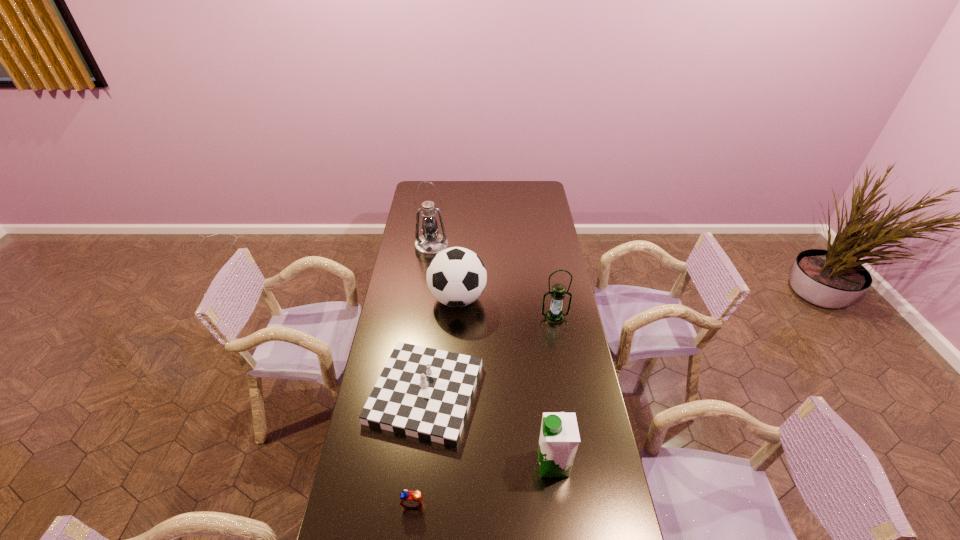
Identify the location of free space located 0.390m on the side where the lantern emits light. (570, 406).

Image resolution: width=960 pixels, height=540 pixels. I want to click on vacant space located on the right of the soccer ball, so click(529, 299).

Locate an element on the screen. blank area located 0.160m on the front-facing side of the second nearest object is located at coordinates (486, 464).

Locate an element on the screen. free region located 0.240m on the front-facing side of the second nearest object is located at coordinates (461, 464).

The width and height of the screenshot is (960, 540). In order to click on free region located on the front-facing side of the second nearest object in this screenshot , I will do `click(517, 464)`.

Where is `free space located on the back of the checkerboard`? The image size is (960, 540). free space located on the back of the checkerboard is located at coordinates (437, 282).

Identify the location of vacant space located 0.080m on the front-facing side of the shortest object. (409, 539).

Locate an element on the screen. This screenshot has height=540, width=960. oil lamp present at the left edge is located at coordinates (430, 243).

Find the location of `checkerboard located in the left edge section of the desktop`. checkerboard located in the left edge section of the desktop is located at coordinates (422, 392).

Where is `lantern at the right edge`? The image size is (960, 540). lantern at the right edge is located at coordinates pyautogui.click(x=554, y=316).